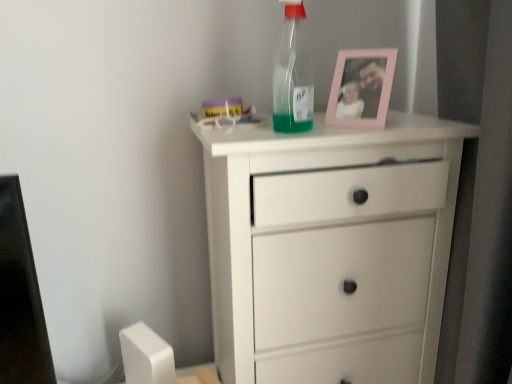
Question: Is pink plastic picture frame at upper center behind white matte chest of drawers at center?

Choices:
 (A) no
 (B) yes

Answer: (B)

Question: Can you confirm if pink plastic picture frame at upper center is wider than white matte chest of drawers at center?

Choices:
 (A) no
 (B) yes

Answer: (A)

Question: Is pink plastic picture frame at upper center closer to the viewer compared to white matte chest of drawers at center?

Choices:
 (A) yes
 (B) no

Answer: (B)

Question: Are pink plastic picture frame at upper center and white matte chest of drawers at center far apart?

Choices:
 (A) no
 (B) yes

Answer: (A)

Question: Does pink plastic picture frame at upper center have a smaller size compared to white matte chest of drawers at center?

Choices:
 (A) no
 (B) yes

Answer: (B)

Question: In the image, is transparent plastic bottle at upper center on the left side or the right side of white matte chest of drawers at center?

Choices:
 (A) left
 (B) right

Answer: (A)

Question: Is transparent plastic bottle at upper center in front of or behind white matte chest of drawers at center in the image?

Choices:
 (A) front
 (B) behind

Answer: (B)

Question: From the image's perspective, relative to white matte chest of drawers at center, is transparent plastic bottle at upper center above or below?

Choices:
 (A) below
 (B) above

Answer: (B)

Question: In terms of height, does transparent plastic bottle at upper center look taller or shorter compared to white matte chest of drawers at center?

Choices:
 (A) short
 (B) tall

Answer: (A)

Question: Based on their positions, is transparent plastic bottle at upper center located to the left or right of pink plastic picture frame at upper center?

Choices:
 (A) right
 (B) left

Answer: (B)

Question: In terms of height, does transparent plastic bottle at upper center look taller or shorter compared to pink plastic picture frame at upper center?

Choices:
 (A) short
 (B) tall

Answer: (B)

Question: From a real-world perspective, is transparent plastic bottle at upper center above or below pink plastic picture frame at upper center?

Choices:
 (A) above
 (B) below

Answer: (A)

Question: Considering the positions of transparent plastic bottle at upper center and pink plastic picture frame at upper center in the image, is transparent plastic bottle at upper center bigger or smaller than pink plastic picture frame at upper center?

Choices:
 (A) big
 (B) small

Answer: (B)

Question: Is point (350, 119) positioned closer to the camera than point (281, 61)?

Choices:
 (A) farther
 (B) closer

Answer: (A)

Question: From the image's perspective, is pink plastic picture frame at upper center located above or below transparent plastic bottle at upper center?

Choices:
 (A) above
 (B) below

Answer: (B)